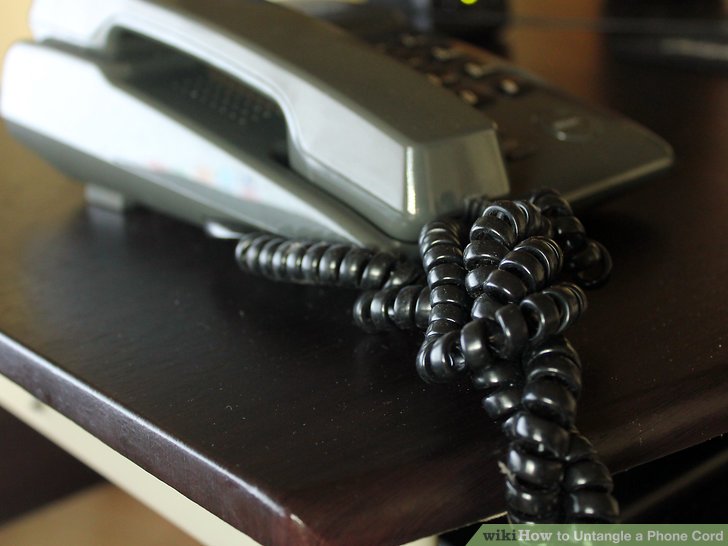
Identify the location of wall. (4, 17).